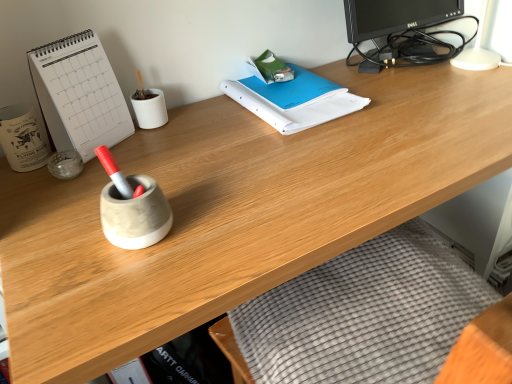
Identify the location of free space to the left of blue paper binder at center. (194, 132).